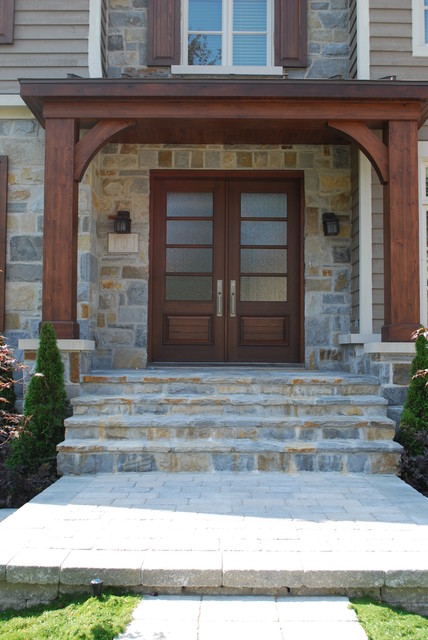
The width and height of the screenshot is (428, 640). I want to click on window sillnatural brick, so point(226,70), point(126,17).